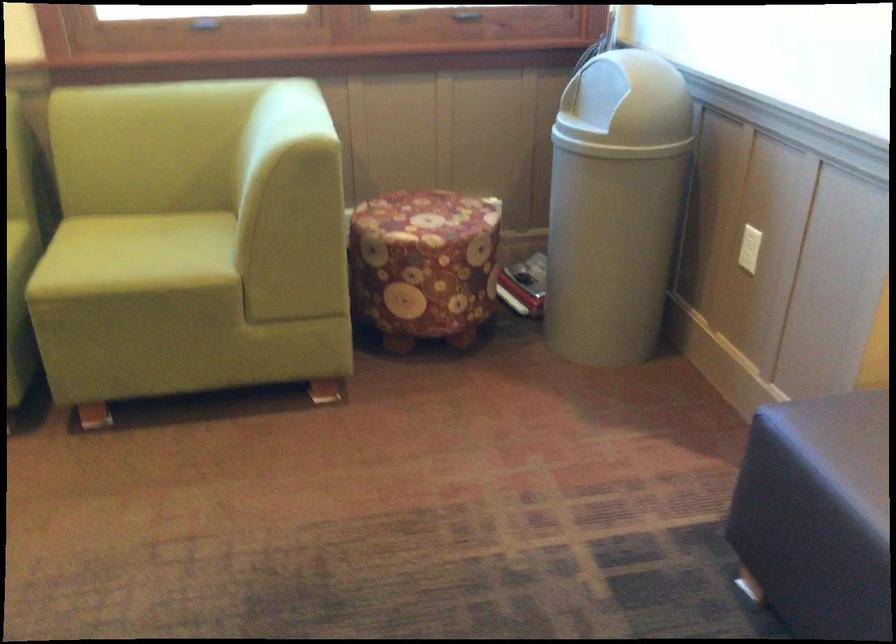
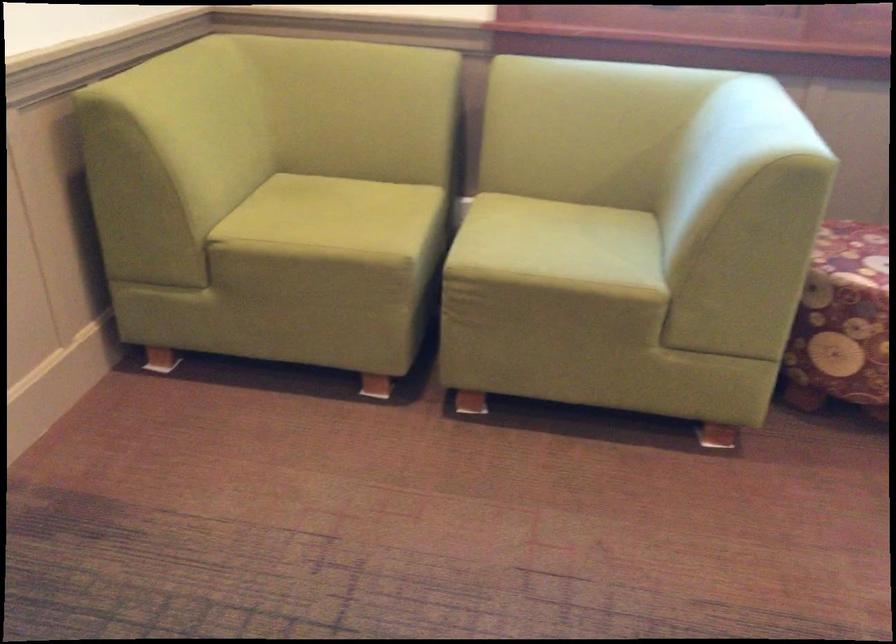
Which direction would the cameraman need to move to produce the second image?

The cameraman walked toward left, forward.